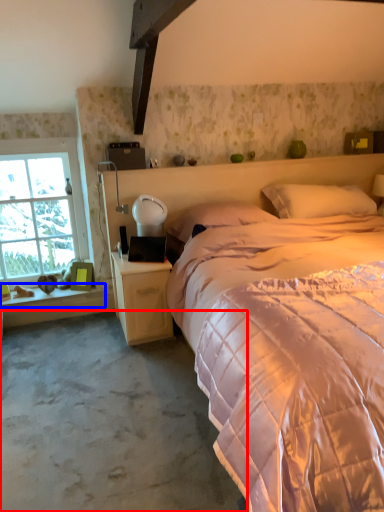
Question: Which of the following is the farthest to the observer, concrete (highlighted by a red box) or window sill (highlighted by a blue box)?

Choices:
 (A) concrete
 (B) window sill

Answer: (B)